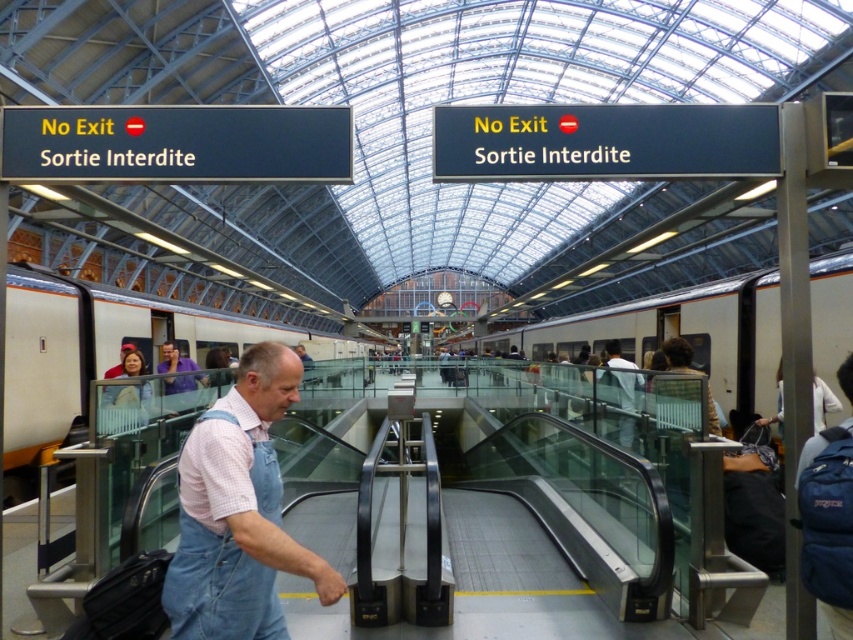
You are a fashion designer observing the denim overalls at center and the purple shirt at center in the train station. Which clothing item appears smaller in size?

The denim overalls at center has a smaller size compared to the purple shirt at center.